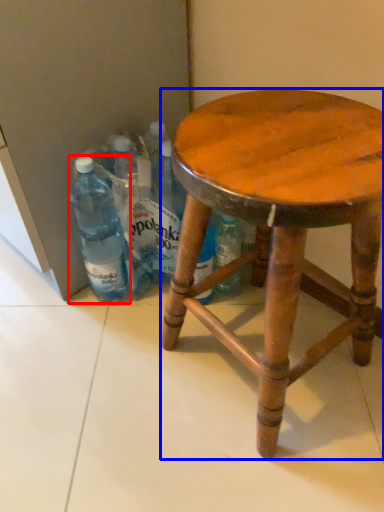
Question: Which object appears farthest to the camera in this image, bottle (highlighted by a red box) or stool (highlighted by a blue box)?

Choices:
 (A) bottle
 (B) stool

Answer: (A)